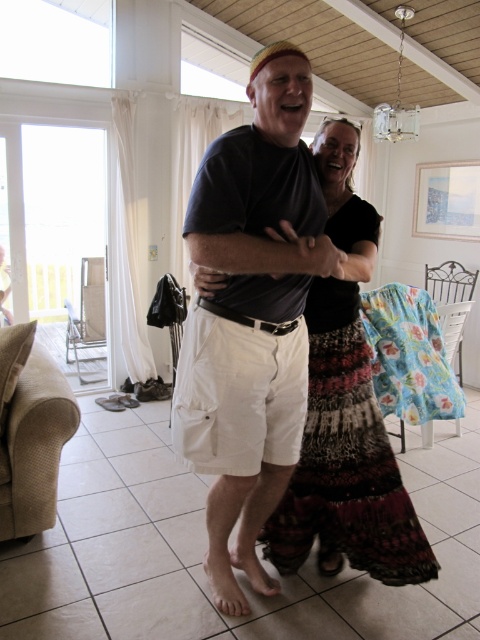
Question: Which point appears closest to the camera in this image?

Choices:
 (A) (233, 260)
 (B) (350, 497)

Answer: (A)

Question: Which object appears closest to the camera in this image?

Choices:
 (A) matte black t-shirt at center
 (B) multicolored woven skirt at center

Answer: (A)

Question: Is matte black t-shirt at center to the left of multicolored woven skirt at center from the viewer's perspective?

Choices:
 (A) yes
 (B) no

Answer: (A)

Question: Which object appears closest to the camera in this image?

Choices:
 (A) multicolored woven skirt at center
 (B) matte black t-shirt at center

Answer: (B)

Question: Is matte black t-shirt at center to the left of multicolored woven skirt at center from the viewer's perspective?

Choices:
 (A) yes
 (B) no

Answer: (A)

Question: Does matte black t-shirt at center have a greater width compared to multicolored woven skirt at center?

Choices:
 (A) yes
 (B) no

Answer: (A)